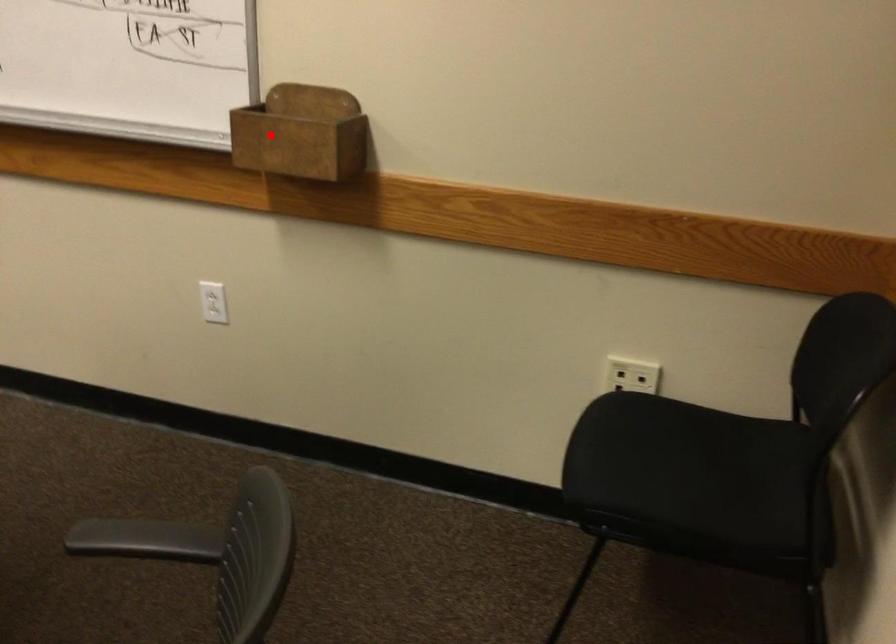
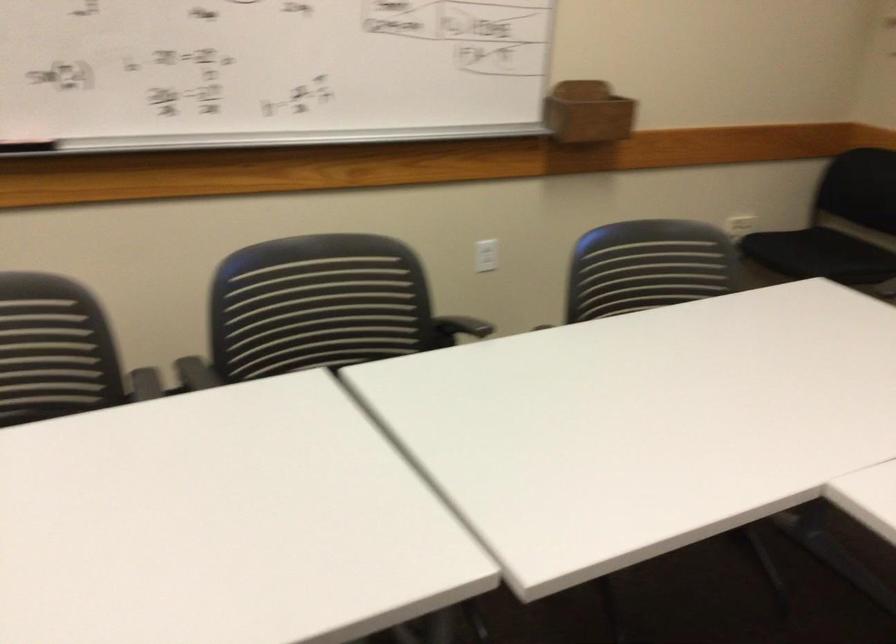
Question: A red point is marked in image1. In image2, is the corresponding 3D point closer to the camera or farther? Reply with the corresponding letter.

Choices:
 (A) The corresponding 3D point is closer.
 (B) The corresponding 3D point is farther.

Answer: (B)